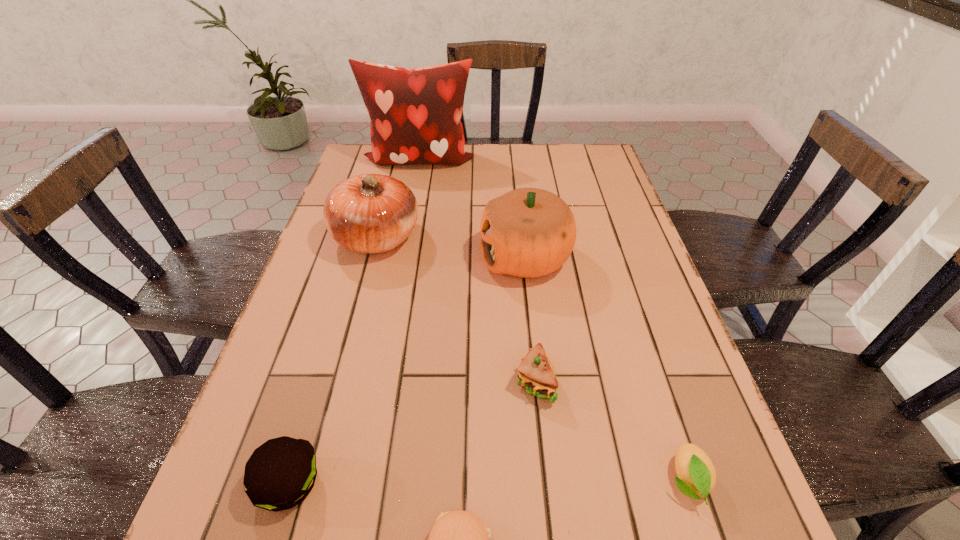
Find the location of a particular element. This screenshot has height=540, width=960. free space located 0.370m on the face of the right pumpkin is located at coordinates (336, 258).

Where is `vacant region located on the face of the right pumpkin`? vacant region located on the face of the right pumpkin is located at coordinates (363, 258).

Locate an element on the screen. vacant space located on the front of the left pumpkin is located at coordinates (352, 330).

Image resolution: width=960 pixels, height=540 pixels. Identify the location of vacant space situated 0.300m on the left of the sandwich. (362, 382).

Find the location of `vacant region located on the right of the taller patty`. vacant region located on the right of the taller patty is located at coordinates (377, 484).

Identify the location of object that is at the far edge. (415, 114).

Where is `cushion located at the left edge`? cushion located at the left edge is located at coordinates (415, 114).

You are a GUI agent. You are given a task and a screenshot of the screen. Output one action in this format:
    pyautogui.click(x=<x>, y=<y>)
    Task: Click on the pumpkin positioned at the left edge
    The width and height of the screenshot is (960, 540).
    Given the screenshot: What is the action you would take?
    pyautogui.click(x=369, y=213)

The height and width of the screenshot is (540, 960). What are the coordinates of `patty located at the left edge` in the screenshot? It's located at (280, 473).

Where is `object that is at the right edge`? The height and width of the screenshot is (540, 960). object that is at the right edge is located at coordinates (696, 473).